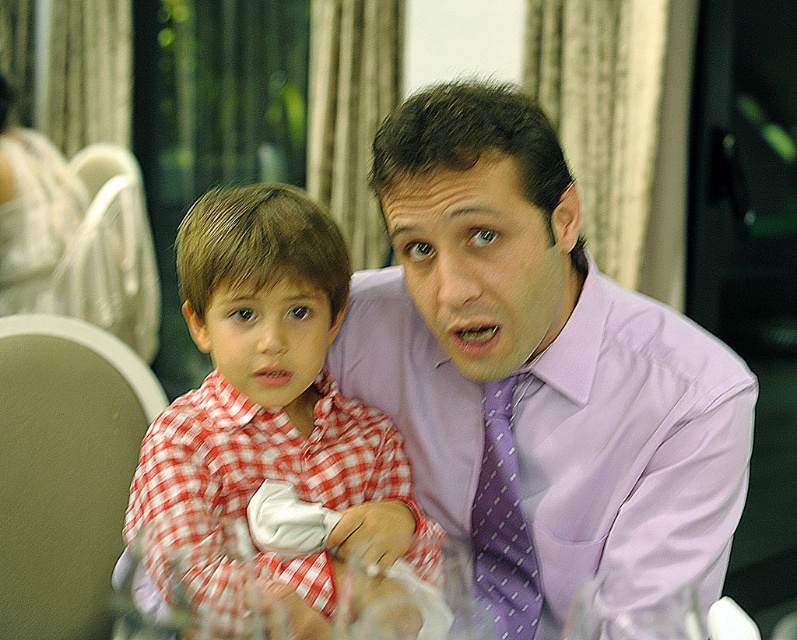
Who is lower down, purple satin dress shirt at center or red checkered shirt at center?

Positioned lower is purple satin dress shirt at center.

Is point (686, 458) positioned after point (336, 512)?

No, (686, 458) is closer to viewer.

What do you see at coordinates (631, 460) in the screenshot? I see `purple satin dress shirt at center` at bounding box center [631, 460].

At what (x,y) coordinates should I click in order to perform the action: click on purple satin dress shirt at center. Please return your answer as a coordinate pair (x, y). Looking at the image, I should click on coord(631,460).

Can you confirm if purple satin dress shirt at center is thinner than purple dotted tie at center?

In fact, purple satin dress shirt at center might be wider than purple dotted tie at center.

Who is more forward, [642,524] or [485,381]?

Point [642,524]

What are the coordinates of `purple satin dress shirt at center` in the screenshot? It's located at (631, 460).

Looking at this image, does red checkered shirt at center appear under purple dotted tie at center?

Incorrect, red checkered shirt at center is not positioned below purple dotted tie at center.

Which is in front, point (238, 442) or point (489, 499)?

Point (238, 442) is in front.

Where is `red checkered shirt at center`? Image resolution: width=797 pixels, height=640 pixels. red checkered shirt at center is located at coordinates (269, 410).